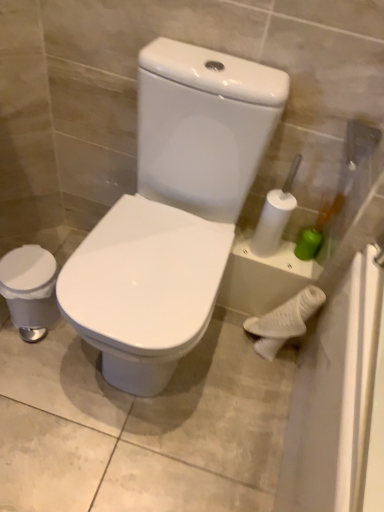
Image resolution: width=384 pixels, height=512 pixels. What are the coordinates of `vacant area to the right of white glossy toilet at center, arranged as the 2th porcelain when viewed from the right` in the screenshot? It's located at 240,374.